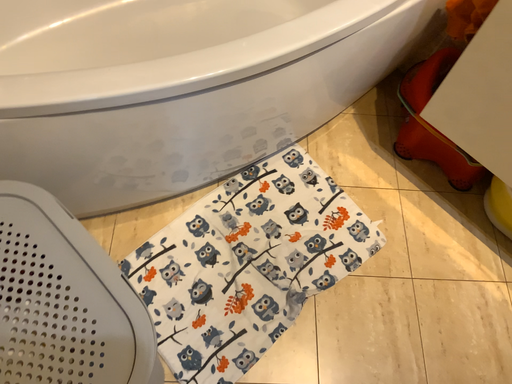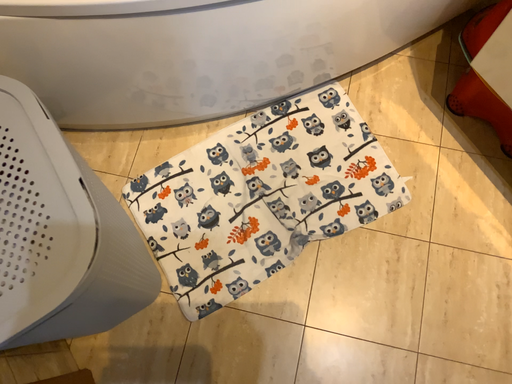
Question: Which way did the camera rotate in the video?

Choices:
 (A) rotated upward
 (B) rotated downward

Answer: (B)